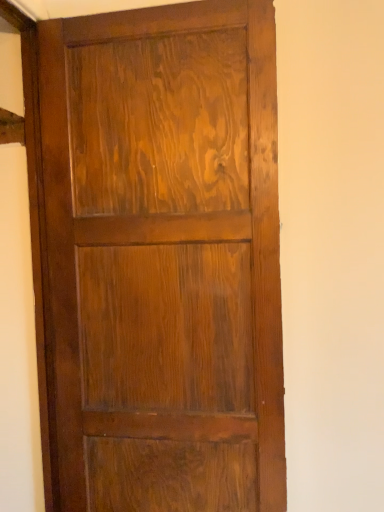
This screenshot has width=384, height=512. What do you see at coordinates (164, 257) in the screenshot? I see `shiny brown wood door at center` at bounding box center [164, 257].

Find the location of a particular element. This screenshot has width=384, height=512. shiny brown wood door at center is located at coordinates (164, 257).

Find the location of a particular element. Image resolution: width=384 pixels, height=512 pixels. shiny brown wood door at center is located at coordinates (164, 257).